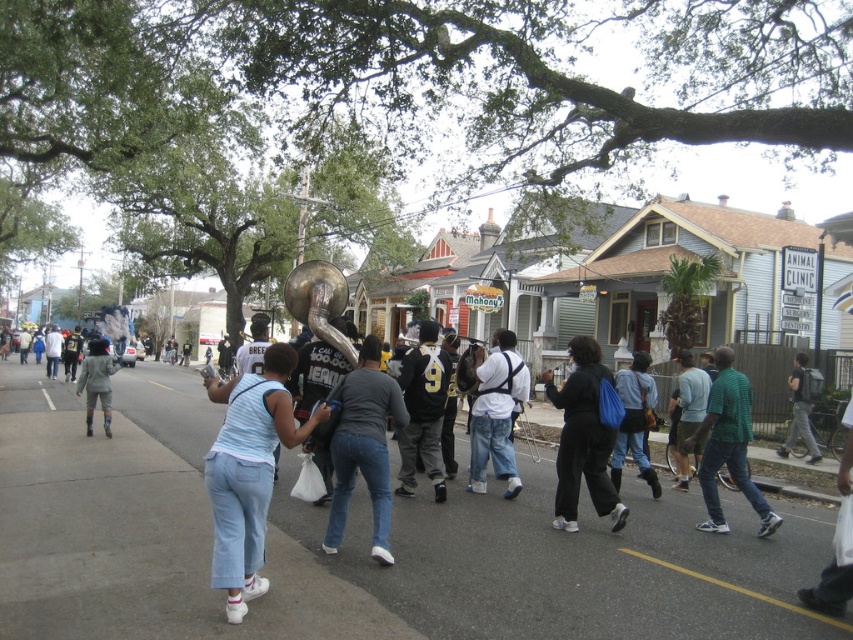
You are a photographer trying to capture a clear photo of the green mesh shirt at center and camouflage pants at center. Since you want both subjects in focus, you need to know which one is taller. Which object is taller?

The green mesh shirt at center is taller than camouflage pants at center.

You are a photographer trying to capture a clear shot of the green mesh shirt at center and the camouflage pants at center. Which clothing item appears smaller in the photo?

The green mesh shirt at center appears smaller in the photo compared to the camouflage pants at center because it has a smaller size.

You are a delivery person trying to cross the gray asphalt road at center while avoiding the green mesh shirt at center. Which object is shorter and can be safely stepped over?

The gray asphalt road at center is shorter than the green mesh shirt at center, so you can safely step over the gray asphalt road at center.